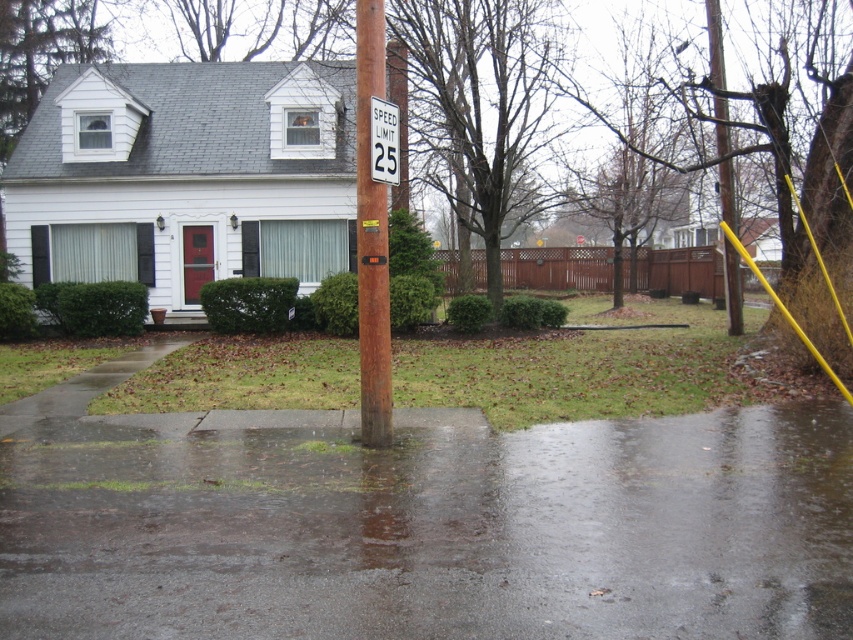
You are standing at the point with coordinates (x=370, y=236) in the image. What object is exactly at this location?

The rusty metal pole at center is located at point (x=370, y=236).

You are a delivery driver who needs to park your car on the wet asphalt at center. However, your car is 5 meters long. The rusty metal pole at center is in the way. Can you park your car without hitting the pole?

The wet asphalt at center has a smaller size compared to the rusty metal pole at center, meaning the parking area is not large enough to accommodate a 5 meter long car without hitting the pole.